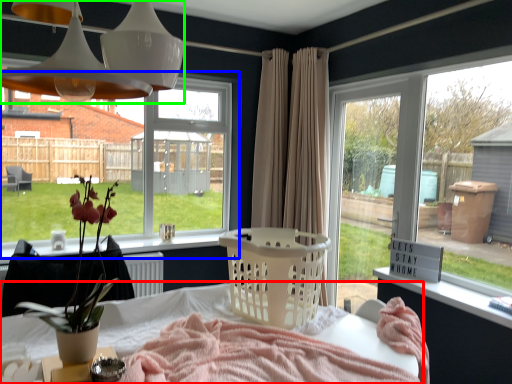
Question: Estimate the real-world distances between objects in this image. Which object is farther from table (highlighted by a red box), window (highlighted by a blue box) or light fixture (highlighted by a green box)?

Choices:
 (A) window
 (B) light fixture

Answer: (A)